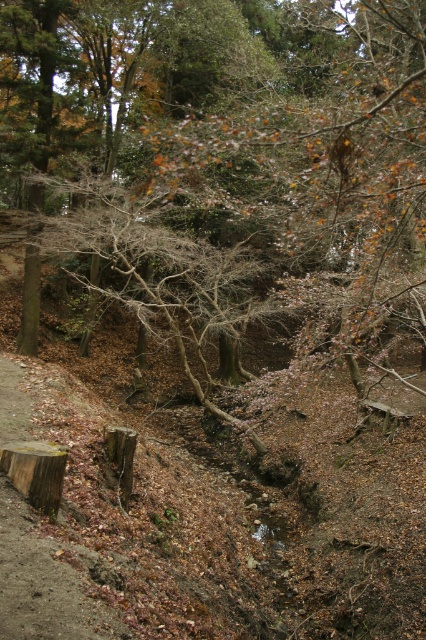
You are standing in the autumn forest scene and want to place a small wooden bench between the brown textured tree at center and the brown rough tree stump at center. Based on their positions, which object should the bench be closer to?

The bench should be closer to the brown textured tree at center because it is nearer to the viewer compared to the brown rough tree stump at center.

You are standing in the forest and want to place a small flag exactly halfway between the brown rough tree stump at lower left and the brown rough tree stump at center. Which stump should you start walking towards first to reach the halfway point?

You should start walking towards the brown rough tree stump at lower left first because it is closer to you than the brown rough tree stump at center. Starting from the closer stump allows you to meet halfway more efficiently.